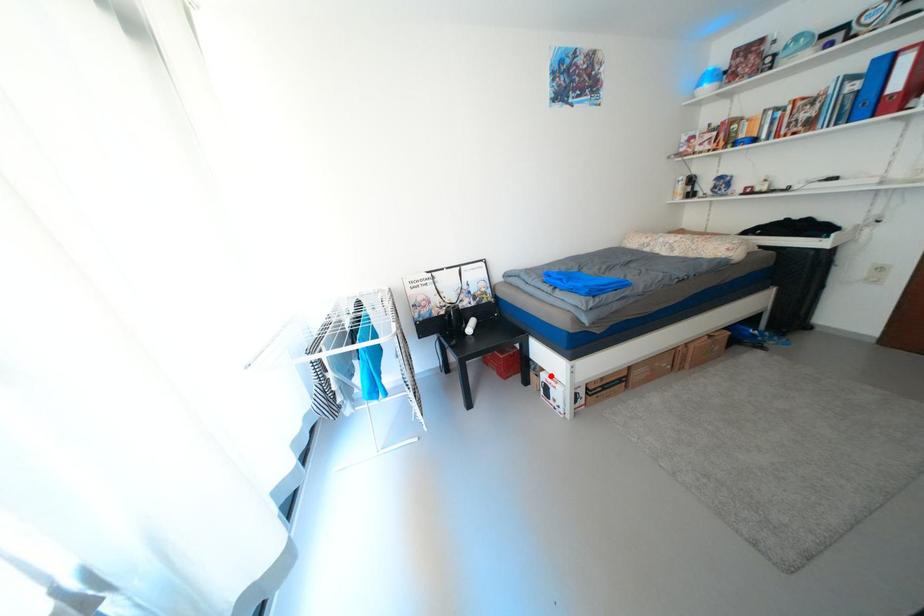
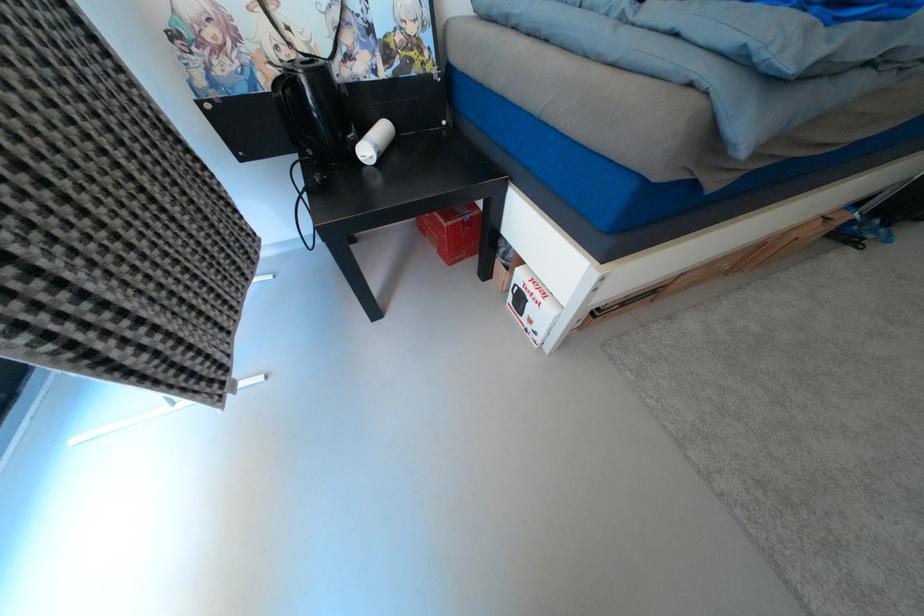
Question: I am providing you with two images of the same scene from different viewpoints. A red point is shown in image1. For the corresponding object point in image2, is it positioned nearer or farther from the camera?

Choices:
 (A) Nearer
 (B) Farther

Answer: (A)